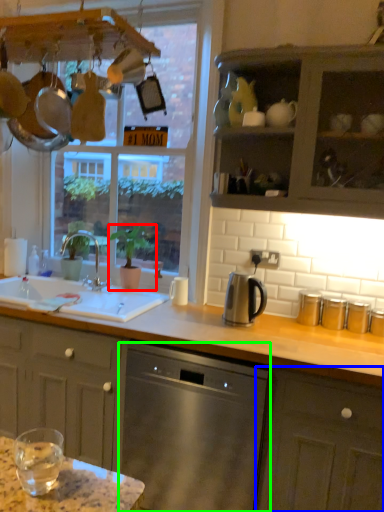
Question: Based on their relative distances, which object is nearer to houseplant (highlighted by a red box)? Choose from cabinetry (highlighted by a blue box) and dishwasher (highlighted by a green box).

Choices:
 (A) cabinetry
 (B) dishwasher

Answer: (B)